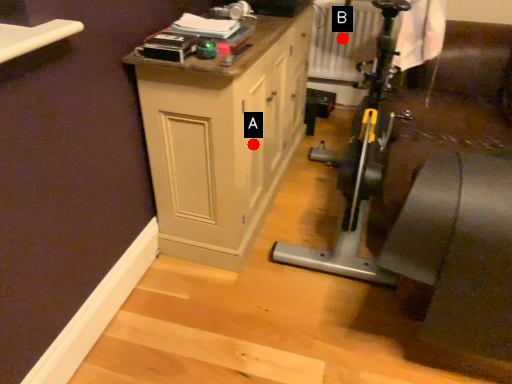
Question: Two points are circled on the image, labeled by A and B beside each circle. Which of the following is the closest to the observer?

Choices:
 (A) A is closer
 (B) B is closer

Answer: (A)